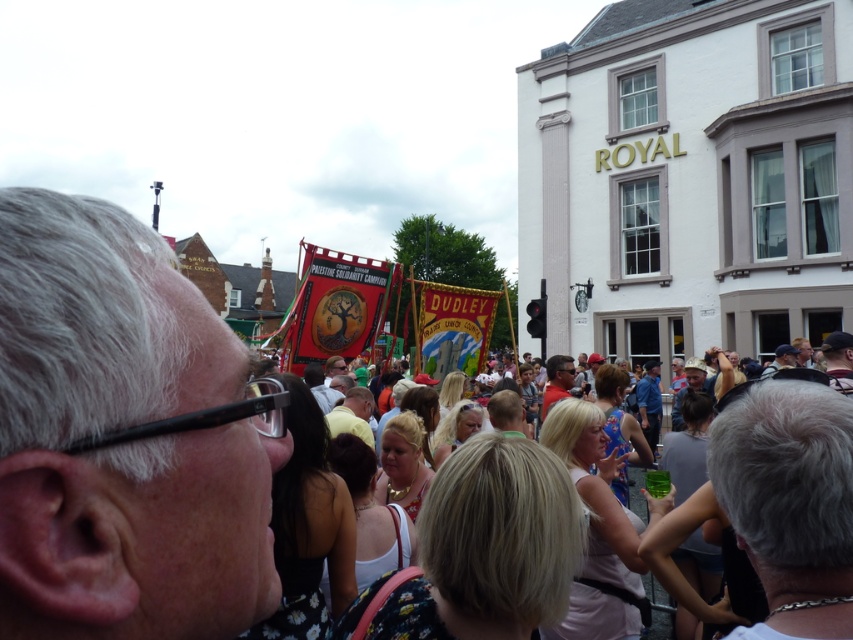
Question: Which of the following is the closest to the observer?

Choices:
 (A) (323, 392)
 (B) (135, 282)
 (C) (352, 426)

Answer: (B)

Question: Is blue denim shirt at center to the right of white fabric shirt at center from the viewer's perspective?

Choices:
 (A) yes
 (B) no

Answer: (A)

Question: Which point appears farthest from the camera in this image?

Choices:
 (A) (546, 365)
 (B) (306, 364)

Answer: (A)

Question: Observing the image, what is the correct spatial positioning of light brown hair at center in reference to white fabric shirt at center?

Choices:
 (A) left
 (B) right

Answer: (B)

Question: Which point is farther from the camera taking this photo?

Choices:
 (A) (334, 358)
 (B) (654, 410)
 (C) (160, 448)

Answer: (B)

Question: Can you confirm if white cotton shirt at center is wider than red shirt at center?

Choices:
 (A) no
 (B) yes

Answer: (B)